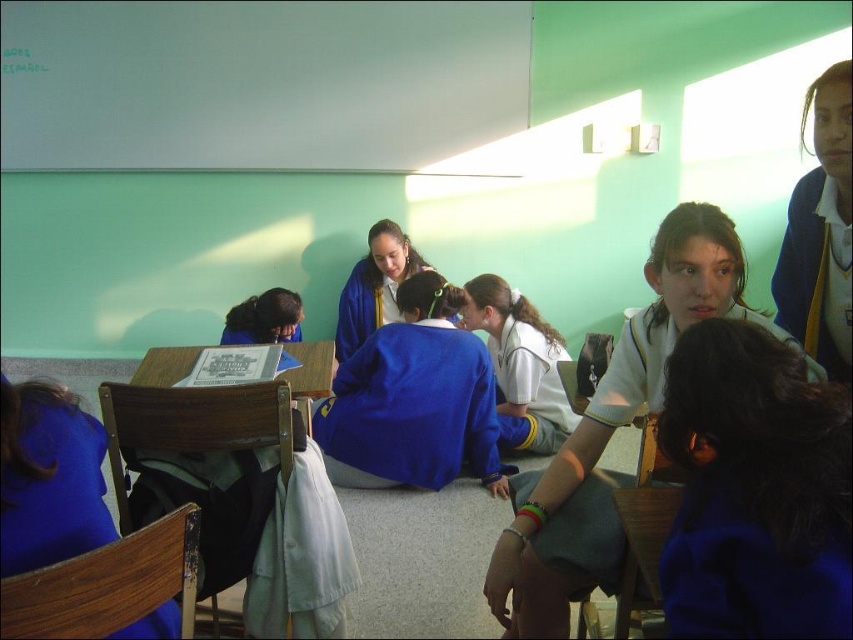
You are a student trying to place a rectangular object on the table in the classroom. The object is 30 cm wide. You see the blue fabric at center and the white jersey at center on the table. Can you fit the object between them?

The blue fabric at center is narrower than the white jersey at center. Since the blue fabric at center has a smaller width, there might be enough space between them to fit the 30 cm wide object, but it depends on their exact positions and the total available space.

You are a photographer trying to capture a clear shot of both the white jersey at center and the blue fabric jacket at center. Since the camera can only focus on one object at a time, which object should you focus on first to ensure it appears larger in the photo?

The white jersey at center is larger in size than the blue fabric jacket at center, so you should focus on the white jersey at center first to ensure it appears larger in the photo.

In the classroom scene, you notice two items at the center of the image. The blue fabric at center and the white jersey at center. Which one is positioned more to the left?

The blue fabric at center is positioned to the left of the white jersey at center.